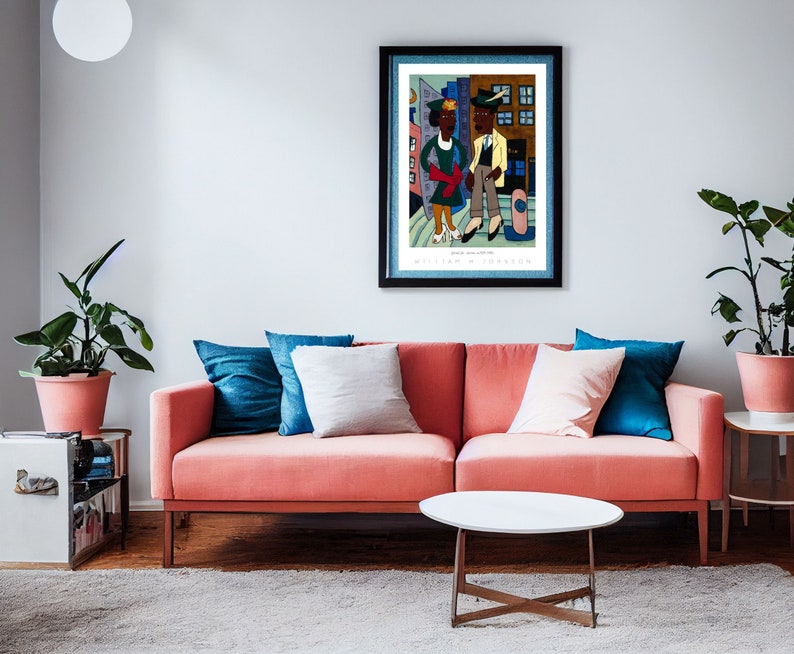
Locate an element on the screen. Image resolution: width=794 pixels, height=654 pixels. black picture frame is located at coordinates (390, 284), (383, 118), (560, 165).